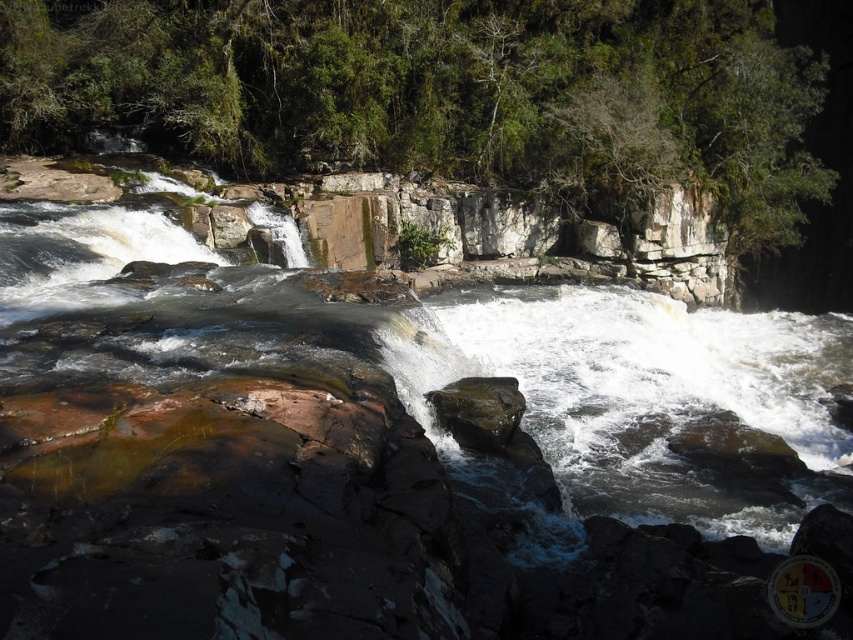
You are standing at point (462, 394) and want to reach the forest in the background. Can you see the forest through point (263, 168) from your current position?

Yes, since point (263, 168) is behind point (462, 394), you can see the forest through point (263, 168) from your current position at (462, 394).

You are a hiker standing at the edge of the river, looking towards the green leafy tree at upper center and the rusty rock at center. Which object is higher in elevation?

The green leafy tree at upper center is taller than the rusty rock at center, so it is higher in elevation.